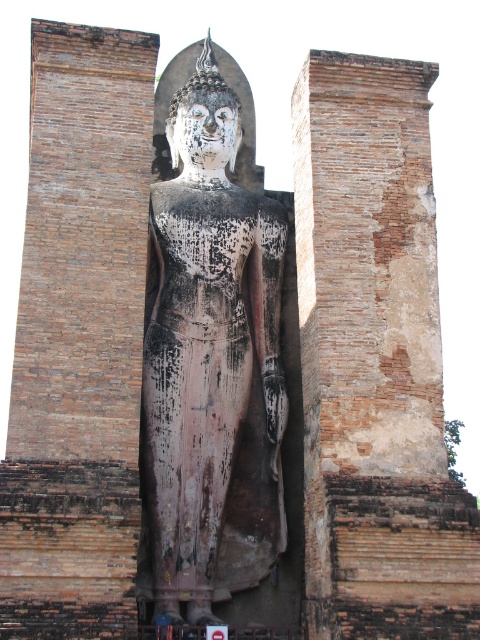
Question: Among these points, which one is farthest from the camera?

Choices:
 (A) (385, 157)
 (B) (210, 589)

Answer: (A)

Question: Is brown textured stone pillar at center to the right of blackened stone statue at center from the viewer's perspective?

Choices:
 (A) no
 (B) yes

Answer: (B)

Question: Can you confirm if brown textured stone pillar at center is bigger than blackened stone statue at center?

Choices:
 (A) yes
 (B) no

Answer: (B)

Question: Which point is farther to the camera?

Choices:
 (A) (172, 568)
 (B) (337, 534)

Answer: (A)

Question: Observing the image, what is the correct spatial positioning of brown textured stone pillar at center in reference to blackened stone statue at center?

Choices:
 (A) left
 (B) right

Answer: (B)